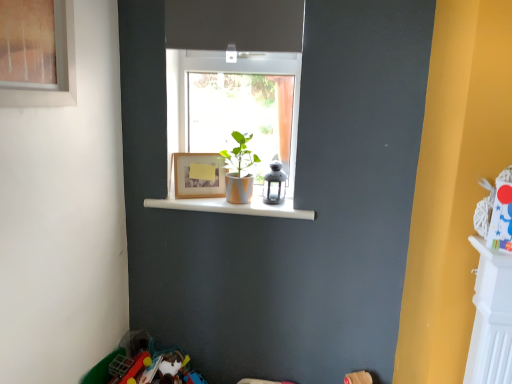
This screenshot has height=384, width=512. What are the coordinates of `free spot above white glossy shelf at center (from a real-world perspective)` in the screenshot? It's located at (234, 198).